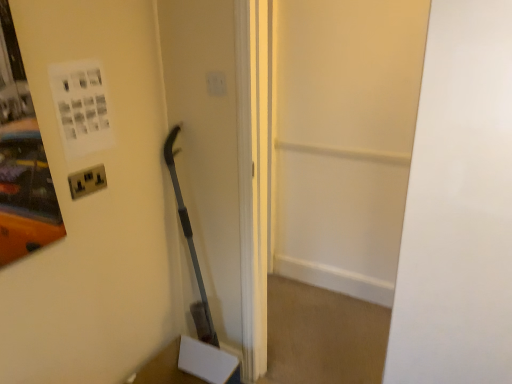
Question: Considering the relative sizes of metallic socket at left and white matte door at center in the image provided, is metallic socket at left thinner than white matte door at center?

Choices:
 (A) yes
 (B) no

Answer: (A)

Question: Is metallic socket at left aimed at white matte door at center?

Choices:
 (A) no
 (B) yes

Answer: (B)

Question: Does metallic socket at left have a greater height compared to white matte door at center?

Choices:
 (A) no
 (B) yes

Answer: (A)

Question: Is metallic socket at left bigger than white matte door at center?

Choices:
 (A) no
 (B) yes

Answer: (A)

Question: Can you confirm if metallic socket at left is positioned to the right of white matte door at center?

Choices:
 (A) no
 (B) yes

Answer: (A)

Question: Is metallic socket at left positioned behind white matte door at center?

Choices:
 (A) yes
 (B) no

Answer: (A)

Question: Would you say white plastic light switch at upper center is a long distance from white matte door at center?

Choices:
 (A) no
 (B) yes

Answer: (B)

Question: Is white plastic light switch at upper center next to white matte door at center?

Choices:
 (A) no
 (B) yes

Answer: (A)

Question: Considering the relative positions of white plastic light switch at upper center and white matte door at center in the image provided, is white plastic light switch at upper center to the right of white matte door at center from the viewer's perspective?

Choices:
 (A) no
 (B) yes

Answer: (A)

Question: Is white plastic light switch at upper center completely or partially outside of white matte door at center?

Choices:
 (A) no
 (B) yes

Answer: (B)

Question: From a real-world perspective, is white plastic light switch at upper center beneath white matte door at center?

Choices:
 (A) no
 (B) yes

Answer: (A)

Question: From the image's perspective, is white plastic light switch at upper center on top of white matte door at center?

Choices:
 (A) no
 (B) yes

Answer: (B)

Question: Considering the relative sizes of transparent glass door at center and white plastic light switch at upper center in the image provided, is transparent glass door at center smaller than white plastic light switch at upper center?

Choices:
 (A) yes
 (B) no

Answer: (B)